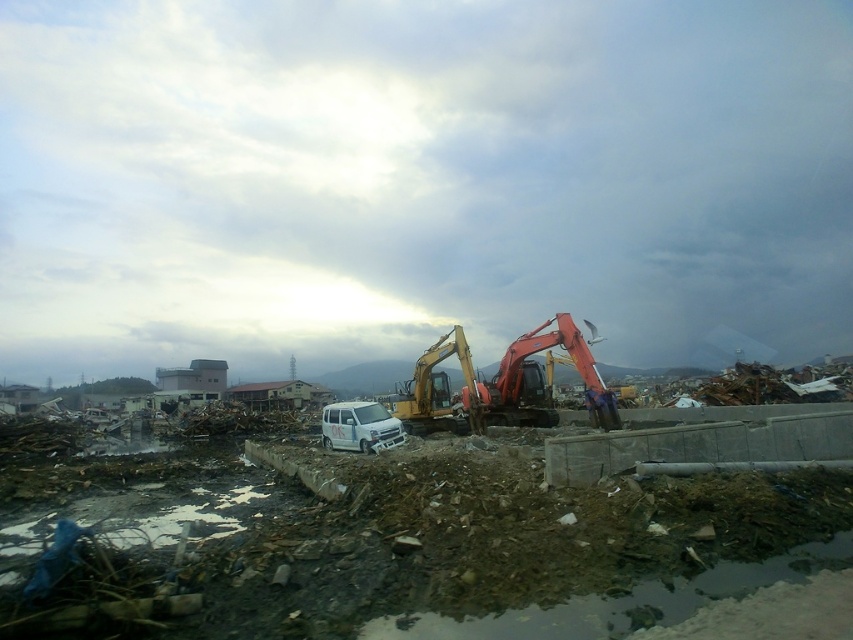
Consider the image. Is metallic yellow excavator at center to the right of orange metallic excavator at center from the viewer's perspective?

No, metallic yellow excavator at center is not to the right of orange metallic excavator at center.

From the picture: Can you confirm if metallic yellow excavator at center is positioned above orange metallic excavator at center?

No.

Where is `metallic yellow excavator at center`? This screenshot has height=640, width=853. metallic yellow excavator at center is located at coordinates (440, 548).